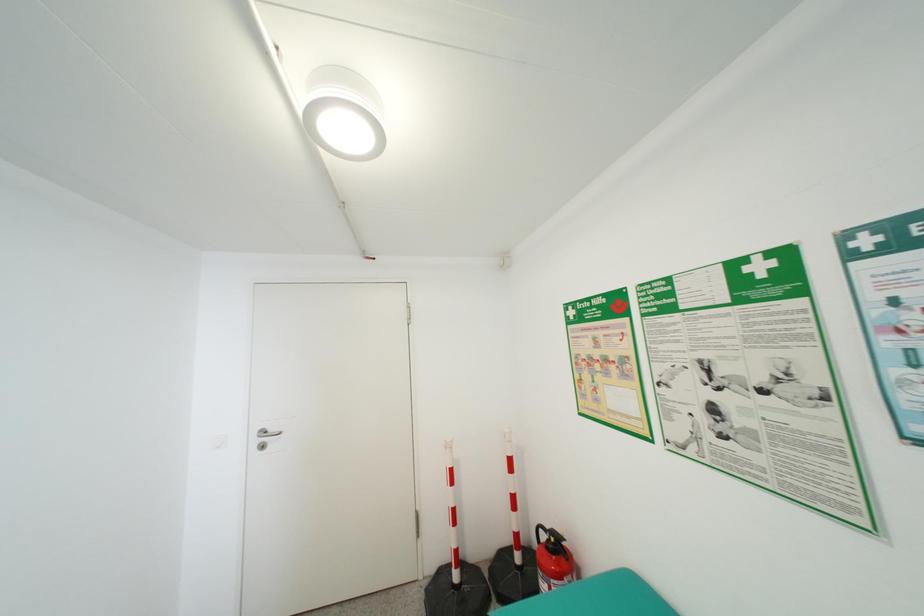
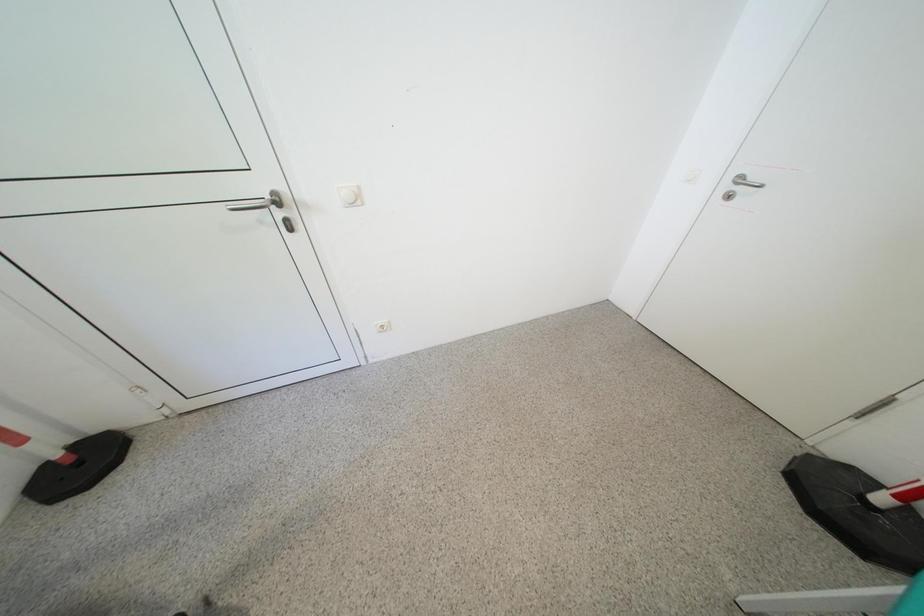
How did the camera likely rotate?

The rotation direction of the camera is left-down.